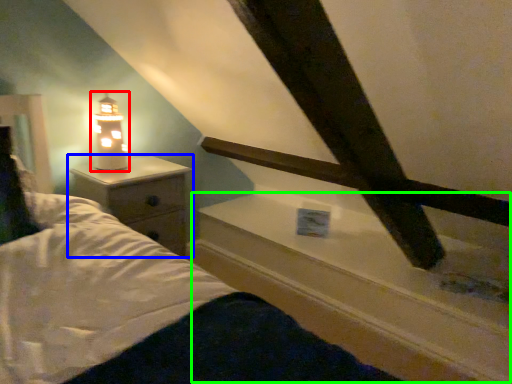
Question: Estimate the real-world distances between objects in this image. Which object is closer to lamp (highlighted by a red box), nightstand (highlighted by a blue box) or window sill (highlighted by a green box)?

Choices:
 (A) nightstand
 (B) window sill

Answer: (A)